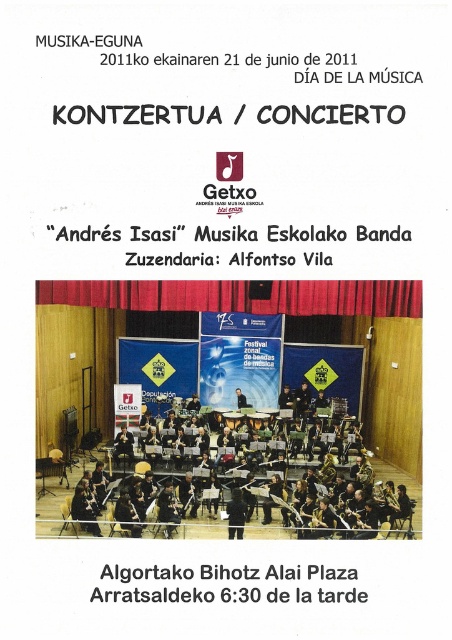
What is the spatial relationship between the black metallic instruments at center and any other objects in the scene?

The black metallic instruments at center are positioned at coordinates point (x=205, y=490).

You are standing in front of the Musika Eguna poster and notice two points marked on it. The first point is at coordinates point(61,509) and the second is at point(277,496). Which of these points is nearer to your eyes?

Point(61,509) is closer to the camera than point(277,496), so the first point is nearer to your eyes.

You are designing a display case for the black metallic instruments at center and the matte black clarinet at center. Which of the two requires a taller space in the display case?

The black metallic instruments at center require a taller space in the display case because they have a greater height compared to the matte black clarinet at center.